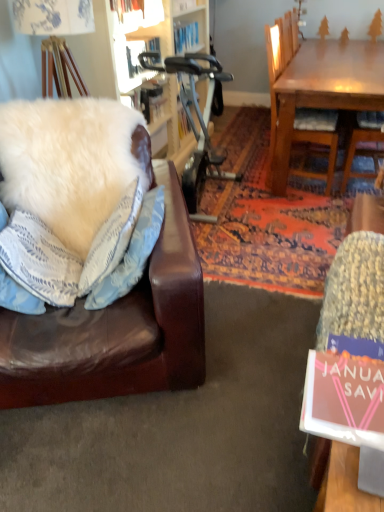
What do you see at coordinates (71, 162) in the screenshot?
I see `white fluffy pillow at left, marked as the second pillow in a right-to-left arrangement` at bounding box center [71, 162].

The width and height of the screenshot is (384, 512). What do you see at coordinates (280, 79) in the screenshot?
I see `wooden chair at upper right` at bounding box center [280, 79].

What do you see at coordinates (132, 254) in the screenshot? I see `white fluffy pillow at left, which ranks as the 3th pillow in left-to-right order` at bounding box center [132, 254].

This screenshot has height=512, width=384. In order to click on white fluffy pillow at left, positioned as the 3th pillow in right-to-left order in this screenshot , I will do `click(39, 260)`.

Where is `white fluffy pillow at left, marked as the second pillow in a right-to-left arrangement`? white fluffy pillow at left, marked as the second pillow in a right-to-left arrangement is located at coordinates (71, 162).

From a real-world perspective, is white fluffy pillow at left, which appears as the 1th pillow when viewed from the left, on white fluffy pillow at left, the 2th pillow in the left-to-right sequence?

No, from a real-world perspective, white fluffy pillow at left, which appears as the 1th pillow when viewed from the left, is not over white fluffy pillow at left, the 2th pillow in the left-to-right sequence

Which object is more forward, white fluffy pillow at left, which appears as the 1th pillow when viewed from the left, or white fluffy pillow at left, marked as the second pillow in a right-to-left arrangement?

white fluffy pillow at left, which appears as the 1th pillow when viewed from the left, is closer to the camera.

Considering the relative sizes of white fluffy pillow at left, which appears as the 1th pillow when viewed from the left, and white fluffy pillow at left, marked as the second pillow in a right-to-left arrangement, in the image provided, is white fluffy pillow at left, which appears as the 1th pillow when viewed from the left, shorter than white fluffy pillow at left, marked as the second pillow in a right-to-left arrangement,?

Yes, white fluffy pillow at left, which appears as the 1th pillow when viewed from the left, is shorter than white fluffy pillow at left, marked as the second pillow in a right-to-left arrangement.

Is white fluffy pillow at left, which ranks as the 1th pillow in right-to-left order, located outside wooden chair at upper right?

That's correct, white fluffy pillow at left, which ranks as the 1th pillow in right-to-left order, is outside of wooden chair at upper right.

Does white fluffy pillow at left, which ranks as the 3th pillow in left-to-right order, appear on the left side of wooden chair at upper right?

Yes.

Image resolution: width=384 pixels, height=512 pixels. I want to click on chair above the white fluffy pillow at left, which ranks as the 3th pillow in left-to-right order (from the image's perspective), so click(x=280, y=79).

Which is in front, point (103, 290) or point (293, 14)?

Point (103, 290)

Considering the positions of points (136, 152) and (150, 224), is point (136, 152) farther from camera compared to point (150, 224)?

That is True.

Do you think white fluffy pillow at left, the 2th pillow in the left-to-right sequence, is within white fluffy pillow at left, which ranks as the 1th pillow in right-to-left order, or outside of it?

The correct answer is: outside.

Does white fluffy pillow at left, marked as the second pillow in a right-to-left arrangement, have a smaller size compared to white fluffy pillow at left, which ranks as the 1th pillow in right-to-left order?

Incorrect, white fluffy pillow at left, marked as the second pillow in a right-to-left arrangement, is not smaller in size than white fluffy pillow at left, which ranks as the 1th pillow in right-to-left order.

In the scene shown: From the image's perspective, is white fluffy pillow at left, marked as the second pillow in a right-to-left arrangement, above or below white fluffy pillow at left, which ranks as the 1th pillow in right-to-left order?

white fluffy pillow at left, marked as the second pillow in a right-to-left arrangement, is situated higher than white fluffy pillow at left, which ranks as the 1th pillow in right-to-left order, in the image.

Is pink matte book at lower right surrounded by white fluffy pillow at left, marked as the second pillow in a right-to-left arrangement?

Definitely not — pink matte book at lower right is not inside white fluffy pillow at left, marked as the second pillow in a right-to-left arrangement.

Is white fluffy pillow at left, marked as the second pillow in a right-to-left arrangement, turned away from pink matte book at lower right?

No, white fluffy pillow at left, marked as the second pillow in a right-to-left arrangement, is not facing the opposite direction of pink matte book at lower right.

From the image's perspective, starting from the pink matte book at lower right, which pillow is the 3rd one above? Please provide its 2D coordinates.

[(71, 162)]

Does white fluffy pillow at left, marked as the second pillow in a right-to-left arrangement, appear on the right side of pink matte book at lower right?

No, white fluffy pillow at left, marked as the second pillow in a right-to-left arrangement, is not to the right of pink matte book at lower right.

Can you confirm if white fluffy pillow at left, which ranks as the 3th pillow in left-to-right order, is taller than knitted fabric swivel chair at lower right?

Indeed, white fluffy pillow at left, which ranks as the 3th pillow in left-to-right order, has a greater height compared to knitted fabric swivel chair at lower right.

Does white fluffy pillow at left, which ranks as the 1th pillow in right-to-left order, turn towards knitted fabric swivel chair at lower right?

No.

Does white fluffy pillow at left, which ranks as the 3th pillow in left-to-right order, have a greater width compared to knitted fabric swivel chair at lower right?

No, white fluffy pillow at left, which ranks as the 3th pillow in left-to-right order, is not wider than knitted fabric swivel chair at lower right.

What's the angular difference between white fluffy pillow at left, which ranks as the 3th pillow in left-to-right order, and knitted fabric swivel chair at lower right's facing directions?

The facing directions of white fluffy pillow at left, which ranks as the 3th pillow in left-to-right order, and knitted fabric swivel chair at lower right are 66.2 degrees apart.

Which is behind, point (36, 170) or point (329, 133)?

The point (329, 133) is farther.

In the scene shown: Who is taller, white fluffy pillow at left, the 2th pillow in the left-to-right sequence, or wooden chair at upper right?

Standing taller between the two is wooden chair at upper right.

Is white fluffy pillow at left, the 2th pillow in the left-to-right sequence, further to camera compared to wooden chair at upper right?

No, white fluffy pillow at left, the 2th pillow in the left-to-right sequence, is closer to the viewer.

From the image's perspective, is pink matte book at lower right above or below white fluffy pillow at left, which ranks as the 1th pillow in right-to-left order?

pink matte book at lower right is situated lower than white fluffy pillow at left, which ranks as the 1th pillow in right-to-left order, in the image.

Is pink matte book at lower right turned away from white fluffy pillow at left, which ranks as the 3th pillow in left-to-right order?

No, white fluffy pillow at left, which ranks as the 3th pillow in left-to-right order, is not at the back of pink matte book at lower right.

Measure the distance between pink matte book at lower right and white fluffy pillow at left, which ranks as the 3th pillow in left-to-right order.

The distance of pink matte book at lower right from white fluffy pillow at left, which ranks as the 3th pillow in left-to-right order, is 29.92 inches.

Which is in front, pink matte book at lower right or white fluffy pillow at left, which ranks as the 1th pillow in right-to-left order?

pink matte book at lower right is in front.

Identify the location of pillow on the left of white fluffy pillow at left, the 2th pillow in the left-to-right sequence. The image size is (384, 512). (39, 260).

Find the location of a particular element. This screenshot has width=384, height=512. the 3rd pillow in front of the wooden chair at upper right is located at coordinates (132, 254).

Estimate the real-world distances between objects in this image. Which object is closer to white fluffy pillow at left, the 2th pillow in the left-to-right sequence, white fluffy pillow at left, which ranks as the 3th pillow in left-to-right order, or white fluffy pillow at left, which appears as the 1th pillow when viewed from the left?

Based on the image, white fluffy pillow at left, which appears as the 1th pillow when viewed from the left, appears to be nearer to white fluffy pillow at left, the 2th pillow in the left-to-right sequence.

Based on the photo, when comparing their distances from white fluffy pillow at left, marked as the second pillow in a right-to-left arrangement, does pink matte book at lower right or white fluffy pillow at left, positioned as the 3th pillow in right-to-left order, seem further?

Based on the image, pink matte book at lower right appears to be further to white fluffy pillow at left, marked as the second pillow in a right-to-left arrangement.

Looking at this image, looking at the image, which one is located further to knitted fabric swivel chair at lower right, white fluffy pillow at left, which ranks as the 1th pillow in right-to-left order, or white fluffy pillow at left, marked as the second pillow in a right-to-left arrangement?

Among the two, white fluffy pillow at left, marked as the second pillow in a right-to-left arrangement, is located further to knitted fabric swivel chair at lower right.

Based on their spatial positions, is knitted fabric swivel chair at lower right or white fluffy pillow at left, which appears as the 1th pillow when viewed from the left, further from white fluffy pillow at left, the 2th pillow in the left-to-right sequence?

The object further to white fluffy pillow at left, the 2th pillow in the left-to-right sequence, is knitted fabric swivel chair at lower right.

Which object lies nearer to the anchor point white fluffy pillow at left, positioned as the 3th pillow in right-to-left order, wooden chair at upper right or white fluffy pillow at left, marked as the second pillow in a right-to-left arrangement?

white fluffy pillow at left, marked as the second pillow in a right-to-left arrangement.

Looking at the image, which one is located closer to wooden chair at upper right, knitted fabric swivel chair at lower right or white fluffy pillow at left, positioned as the 3th pillow in right-to-left order?

Among the two, white fluffy pillow at left, positioned as the 3th pillow in right-to-left order, is located nearer to wooden chair at upper right.

When comparing their distances from wooden chair at upper right, does white fluffy pillow at left, marked as the second pillow in a right-to-left arrangement, or white fluffy pillow at left, which appears as the 1th pillow when viewed from the left, seem further?

white fluffy pillow at left, which appears as the 1th pillow when viewed from the left, is further to wooden chair at upper right.

Based on their spatial positions, is wooden chair at upper right or white fluffy pillow at left, marked as the second pillow in a right-to-left arrangement, closer to white fluffy pillow at left, which ranks as the 3th pillow in left-to-right order?

white fluffy pillow at left, marked as the second pillow in a right-to-left arrangement, is closer to white fluffy pillow at left, which ranks as the 3th pillow in left-to-right order.

Image resolution: width=384 pixels, height=512 pixels. In order to click on pillow situated between white fluffy pillow at left, the 2th pillow in the left-to-right sequence, and pink matte book at lower right from left to right in this screenshot , I will do `click(132, 254)`.

You are a GUI agent. You are given a task and a screenshot of the screen. Output one action in this format:
    pyautogui.click(x=<x>, y=<y>)
    Task: Click on the book between white fluffy pillow at left, which ranks as the 1th pillow in right-to-left order, and knitted fabric swivel chair at lower right
    The height and width of the screenshot is (512, 384).
    Given the screenshot: What is the action you would take?
    pyautogui.click(x=344, y=399)

Locate an element on the screen. The height and width of the screenshot is (512, 384). swivel chair between pink matte book at lower right and wooden chair at upper right along the z-axis is located at coordinates (349, 358).

This screenshot has width=384, height=512. What are the coordinates of `book located between white fluffy pillow at left, marked as the second pillow in a right-to-left arrangement, and knitted fabric swivel chair at lower right in the left-right direction` in the screenshot? It's located at (344, 399).